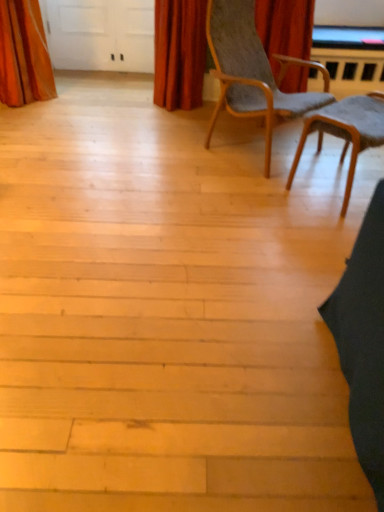
At what (x,y) coordinates should I click in order to perform the action: click on vacant area that is in front of light brown wood chair at center, the 2th chair positioned from the right. Please return your answer as a coordinate pair (x, y). Image resolution: width=384 pixels, height=512 pixels. Looking at the image, I should click on (250, 204).